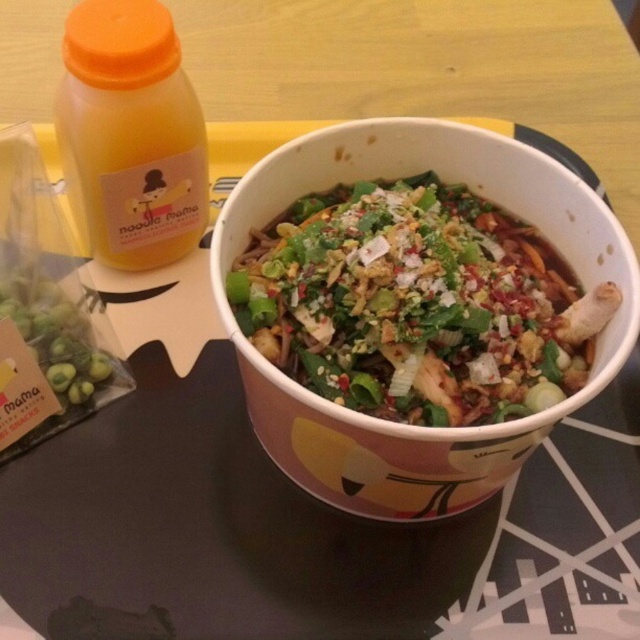
Who is taller, orange plastic bottle at upper left or green matte olives at lower left?

With more height is orange plastic bottle at upper left.

Is orange plastic bottle at upper left to the left of green matte olives at lower left from the viewer's perspective?

Incorrect, orange plastic bottle at upper left is not on the left side of green matte olives at lower left.

This screenshot has width=640, height=640. Find the location of `orange plastic bottle at upper left`. orange plastic bottle at upper left is located at coordinates (131, 134).

Does white paper bowl at center appear on the left side of orange plastic bottle at upper left?

In fact, white paper bowl at center is to the right of orange plastic bottle at upper left.

Describe the element at coordinates (403, 424) in the screenshot. This screenshot has width=640, height=640. I see `white paper bowl at center` at that location.

What do you see at coordinates (403, 424) in the screenshot? The width and height of the screenshot is (640, 640). I see `white paper bowl at center` at bounding box center [403, 424].

Identify the location of white paper bowl at center. This screenshot has height=640, width=640. coord(403,424).

Which is behind, point (348, 456) or point (67, 381)?

The point (67, 381) is behind.

At what (x,y) coordinates should I click in order to perform the action: click on white paper bowl at center. Please return your answer as a coordinate pair (x, y). This screenshot has width=640, height=640. Looking at the image, I should click on [x=403, y=424].

The width and height of the screenshot is (640, 640). What do you see at coordinates (403, 424) in the screenshot? I see `white paper bowl at center` at bounding box center [403, 424].

Where is `white paper bowl at center`? This screenshot has width=640, height=640. white paper bowl at center is located at coordinates (403, 424).